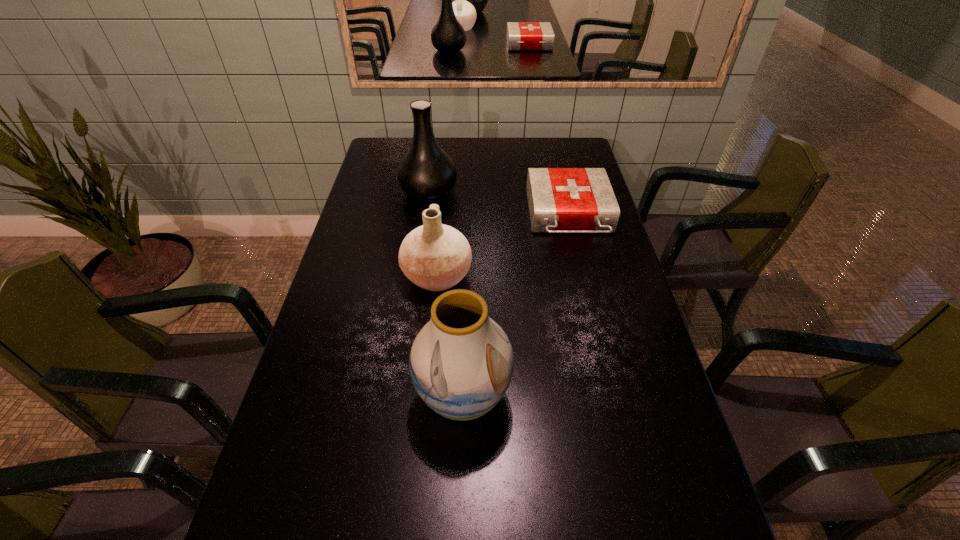
Where is `free spot between the second nearest object and the rightmost object`? free spot between the second nearest object and the rightmost object is located at coordinates (503, 246).

Image resolution: width=960 pixels, height=540 pixels. In order to click on object that is the third closest to the third farthest object in this screenshot , I will do `click(426, 172)`.

Where is `object that is the closest to the nearest object`? object that is the closest to the nearest object is located at coordinates (434, 256).

The width and height of the screenshot is (960, 540). I want to click on blank area in the image that satisfies the following two spatial constraints: 1. on the front side of the nearest object; 2. on the right side of the farther vase, so click(x=399, y=396).

Where is `vacant space that satisfies the following two spatial constraints: 1. on the front side of the farther vase; 2. on the left side of the nearer vase`? vacant space that satisfies the following two spatial constraints: 1. on the front side of the farther vase; 2. on the left side of the nearer vase is located at coordinates (399, 396).

You are a GUI agent. You are given a task and a screenshot of the screen. Output one action in this format:
    pyautogui.click(x=<x>, y=<y>)
    Task: Click on the vacant area in the image that satisfies the following two spatial constraints: 1. to pour from the handle of the third tallest object; 2. on the left side of the nearest object
    Image resolution: width=960 pixels, height=540 pixels.
    Given the screenshot: What is the action you would take?
    pyautogui.click(x=425, y=396)

Image resolution: width=960 pixels, height=540 pixels. In order to click on vacant area in the image that satisfies the following two spatial constraints: 1. on the front side of the nearer vase; 2. on the right side of the farther vase in this screenshot , I will do `click(399, 396)`.

You are a GUI agent. You are given a task and a screenshot of the screen. Output one action in this format:
    pyautogui.click(x=<x>, y=<y>)
    Task: Click on the vacant region that satisfies the following two spatial constraints: 1. on the front side of the first-aid kit; 2. to pour from the handle of the pottery
    The image size is (960, 540).
    Given the screenshot: What is the action you would take?
    pyautogui.click(x=583, y=276)

The height and width of the screenshot is (540, 960). What are the coordinates of `vacant point that satisfies the following two spatial constraints: 1. on the front side of the shortest object; 2. to pour from the handle of the second shortest object` in the screenshot? It's located at (583, 276).

The image size is (960, 540). Find the location of `free space that satisfies the following two spatial constraints: 1. on the front side of the farther vase; 2. on the right side of the nearest object`. free space that satisfies the following two spatial constraints: 1. on the front side of the farther vase; 2. on the right side of the nearest object is located at coordinates (399, 396).